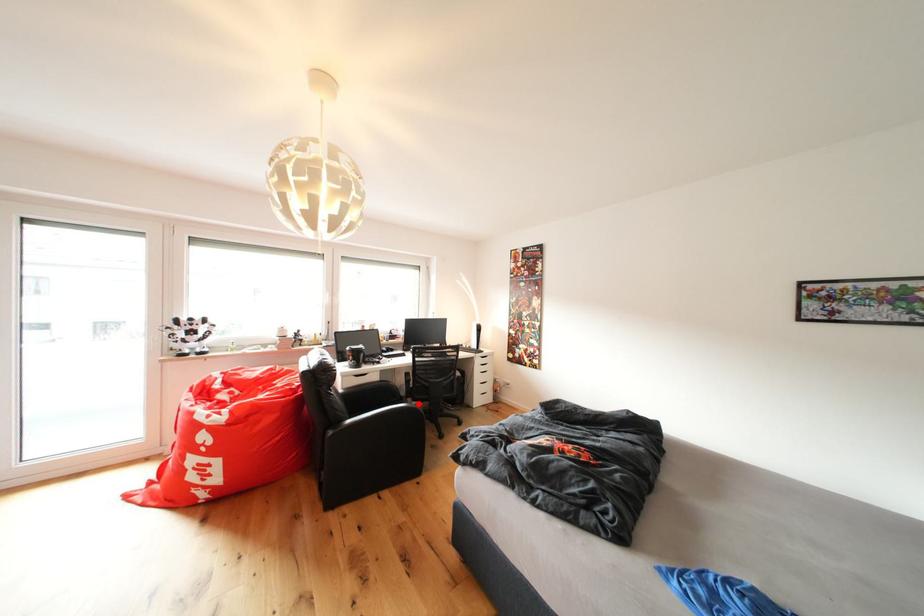
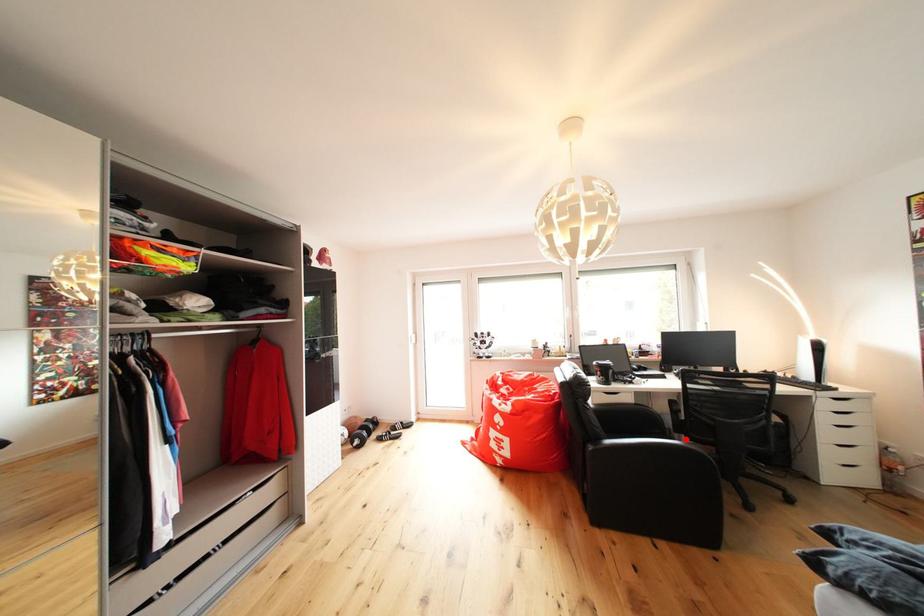
In the scene shown: I am providing you with two images of the same scene from different viewpoints. A red point is marked on the first image and another point is marked on the second image. Is the marked point in image1 the same physical position as the marked point in image2?

Yes